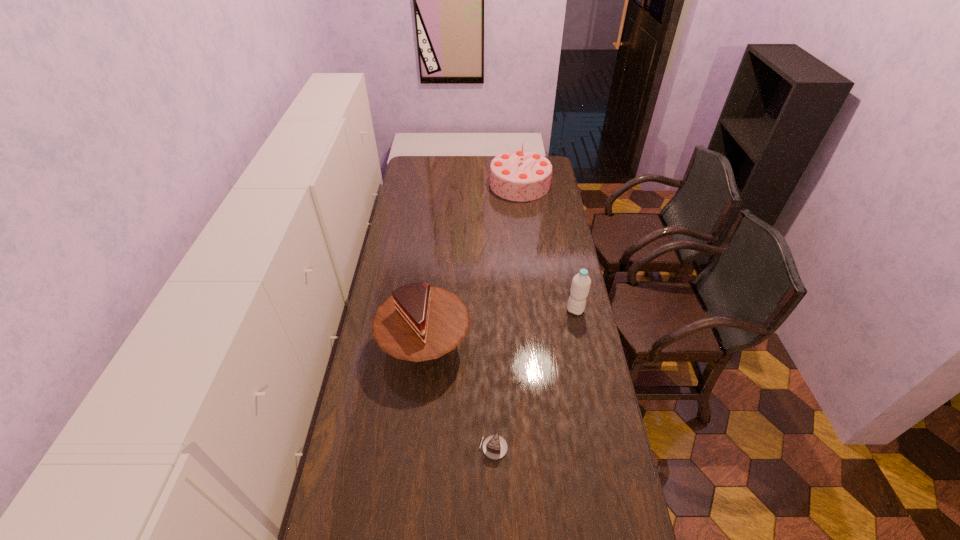
The width and height of the screenshot is (960, 540). Identify the location of the farthest object. (519, 175).

Where is `cake`? Image resolution: width=960 pixels, height=540 pixels. cake is located at coordinates (418, 322).

Identify the location of water bottle. (581, 282).

Locate an element on the screen. This screenshot has height=540, width=960. chocolate cake is located at coordinates pyautogui.click(x=495, y=447).

Where is `the shortest object`? the shortest object is located at coordinates (495, 447).

Identify the location of vacant space located on the left of the farthest object. (425, 184).

What are the coordinates of `free space located on the front of the cake` in the screenshot? It's located at (413, 451).

What are the coordinates of `vacant space located on the front of the water bottle` in the screenshot? It's located at (588, 375).

At what (x,y) coordinates should I click in order to perform the action: click on vacant space located on the back of the shortest object. Please return your answer as a coordinate pair (x, y). The width and height of the screenshot is (960, 540). Looking at the image, I should click on (492, 379).

Find the location of a particular element. This screenshot has width=960, height=540. object located at the far edge is located at coordinates (519, 175).